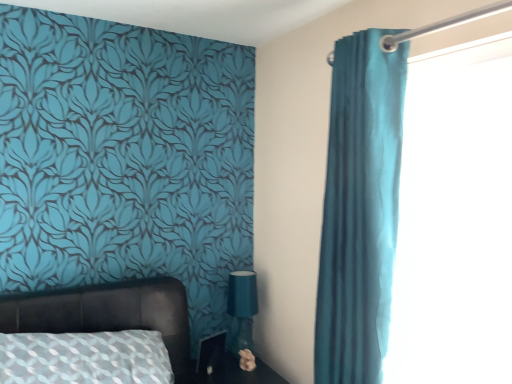
Question: Can you confirm if teal fabric curtain at right is smaller than teal fabric curtain at right?

Choices:
 (A) no
 (B) yes

Answer: (B)

Question: Is teal fabric curtain at right taller than teal fabric curtain at right?

Choices:
 (A) no
 (B) yes

Answer: (A)

Question: From the image's perspective, does teal fabric curtain at right appear higher than teal fabric curtain at right?

Choices:
 (A) no
 (B) yes

Answer: (A)

Question: Is teal fabric curtain at right to the right of teal fabric curtain at right from the viewer's perspective?

Choices:
 (A) yes
 (B) no

Answer: (A)

Question: Is teal fabric curtain at right shorter than teal fabric curtain at right?

Choices:
 (A) yes
 (B) no

Answer: (A)

Question: Considering the relative positions of leather-like bed at lower left and fluffy beige flower at lower center in the image provided, is leather-like bed at lower left to the left or to the right of fluffy beige flower at lower center?

Choices:
 (A) left
 (B) right

Answer: (A)

Question: From a real-world perspective, is leather-like bed at lower left physically located above or below fluffy beige flower at lower center?

Choices:
 (A) below
 (B) above

Answer: (B)

Question: Is leather-like bed at lower left spatially inside fluffy beige flower at lower center, or outside of it?

Choices:
 (A) outside
 (B) inside

Answer: (A)

Question: From the image's perspective, is leather-like bed at lower left positioned above or below fluffy beige flower at lower center?

Choices:
 (A) above
 (B) below

Answer: (A)

Question: Considering the positions of point (242, 367) and point (486, 228), is point (242, 367) closer or farther from the camera than point (486, 228)?

Choices:
 (A) farther
 (B) closer

Answer: (A)

Question: Visually, is fluffy beige flower at lower center positioned to the left or to the right of teal fabric curtain at right?

Choices:
 (A) left
 (B) right

Answer: (A)

Question: From a real-world perspective, is fluffy beige flower at lower center above or below teal fabric curtain at right?

Choices:
 (A) above
 (B) below

Answer: (B)

Question: Is fluffy beige flower at lower center spatially inside teal fabric curtain at right, or outside of it?

Choices:
 (A) outside
 (B) inside

Answer: (A)

Question: Is matte black side table at lower center inside or outside of leather-like bed at lower left?

Choices:
 (A) inside
 (B) outside

Answer: (B)

Question: Is matte black side table at lower center bigger or smaller than leather-like bed at lower left?

Choices:
 (A) big
 (B) small

Answer: (B)